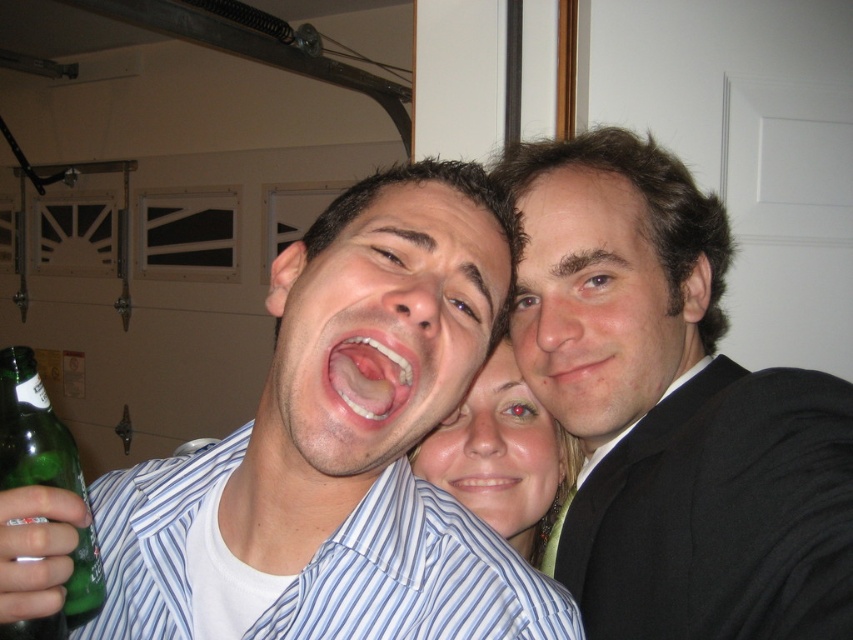
Question: Among these points, which one is nearest to the camera?

Choices:
 (A) (553, 260)
 (B) (59, 465)
 (C) (654, 328)

Answer: (B)

Question: Where is smooth black suit at upper right located in relation to pink glossy lips at center in the image?

Choices:
 (A) left
 (B) right

Answer: (B)

Question: Can you confirm if black suit at right is positioned to the right of white glossy teeth at center?

Choices:
 (A) no
 (B) yes

Answer: (B)

Question: Estimate the real-world distances between objects in this image. Which object is farther from the smooth black suit at upper right?

Choices:
 (A) white glossy teeth at center
 (B) smooth skin at center
 (C) smooth skin face at center
 (D) black suit at right

Answer: (A)

Question: Which is nearer to the smooth skin at center?

Choices:
 (A) smooth skin face at center
 (B) matte white shirt at center
 (C) pink glossy lips at center
 (D) smooth black suit at upper right

Answer: (D)

Question: Is smooth skin face at center positioned behind green glass bottle at lower left?

Choices:
 (A) yes
 (B) no

Answer: (A)